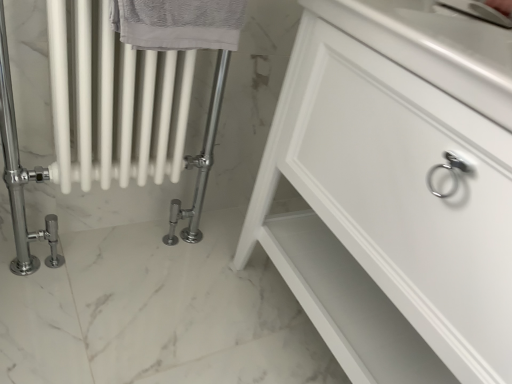
Question: In terms of width, does gray textured towel at upper left look wider or thinner when compared to white glossy radiator at left?

Choices:
 (A) thin
 (B) wide

Answer: (A)

Question: Is point coord(120,31) positioned closer to the camera than point coord(197,182)?

Choices:
 (A) farther
 (B) closer

Answer: (B)

Question: Which object is the farthest from the white glossy radiator at left?

Choices:
 (A) white glossy cabinet at center
 (B) gray textured towel at upper left

Answer: (A)

Question: Based on their relative distances, which object is farther from the white glossy radiator at left?

Choices:
 (A) gray textured towel at upper left
 (B) white glossy cabinet at center

Answer: (B)